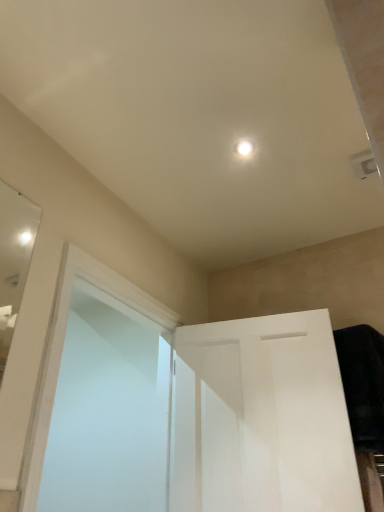
Measure the distance between frosted glass screen door at left and camera.

They are 1.77 meters apart.

The image size is (384, 512). What do you see at coordinates (109, 410) in the screenshot? I see `frosted glass screen door at left` at bounding box center [109, 410].

Locate an element on the screen. The width and height of the screenshot is (384, 512). frosted glass screen door at left is located at coordinates (109, 410).

What do you see at coordinates (261, 418) in the screenshot? This screenshot has height=512, width=384. I see `white matte door at center` at bounding box center [261, 418].

At what (x,y) coordinates should I click in order to perform the action: click on white matte door at center. Please return your answer as a coordinate pair (x, y). The width and height of the screenshot is (384, 512). Looking at the image, I should click on (261, 418).

The height and width of the screenshot is (512, 384). In order to click on frosted glass screen door at left in this screenshot , I will do `click(109, 410)`.

Based on their positions, is frosted glass screen door at left located to the left or right of white matte door at center?

frosted glass screen door at left is to the left of white matte door at center.

Relative to white matte door at center, is frosted glass screen door at left in front or behind?

In the image, frosted glass screen door at left appears in front of white matte door at center.

Which is more distant, (139, 456) or (202, 390)?

The point (139, 456) is farther.

From the image's perspective, who appears lower, frosted glass screen door at left or white matte door at center?

white matte door at center is shown below in the image.

From a real-world perspective, is frosted glass screen door at left over white matte door at center?

Yes.

Between frosted glass screen door at left and white matte door at center, which one has larger width?

Wider between the two is frosted glass screen door at left.

Can you confirm if frosted glass screen door at left is taller than white matte door at center?

Yes, frosted glass screen door at left is taller than white matte door at center.

Consider the image. Is frosted glass screen door at left bigger or smaller than white matte door at center?

frosted glass screen door at left is bigger than white matte door at center.

Is white matte door at center inside frosted glass screen door at left?

No, white matte door at center is not a part of frosted glass screen door at left.

Is there a large distance between frosted glass screen door at left and white matte door at center?

No, frosted glass screen door at left is not far away from white matte door at center.

Is frosted glass screen door at left facing towards white matte door at center?

Yes, frosted glass screen door at left is aimed at white matte door at center.

What's the angular difference between frosted glass screen door at left and white matte door at center's facing directions?

They differ by 79.1 degrees in their facing directions.

At what (x,y) coordinates should I click in order to perform the action: click on screen door in front of the white matte door at center. Please return your answer as a coordinate pair (x, y). The height and width of the screenshot is (512, 384). Looking at the image, I should click on (109, 410).

Between white matte door at center and frosted glass screen door at left, which one appears on the left side from the viewer's perspective?

frosted glass screen door at left.

Between white matte door at center and frosted glass screen door at left, which one is positioned behind?

white matte door at center is further away from the camera.

Does point (219, 455) come in front of point (131, 478)?

Yes, point (219, 455) is closer to viewer.

From the image's perspective, which object appears higher, white matte door at center or frosted glass screen door at left?

frosted glass screen door at left is shown above in the image.

From a real-world perspective, is white matte door at center below frosted glass screen door at left?

Yes.

Which object is wider, white matte door at center or frosted glass screen door at left?

frosted glass screen door at left is wider.

Considering the sizes of objects white matte door at center and frosted glass screen door at left in the image provided, who is shorter, white matte door at center or frosted glass screen door at left?

white matte door at center.

Considering the sizes of objects white matte door at center and frosted glass screen door at left in the image provided, who is smaller, white matte door at center or frosted glass screen door at left?

With smaller size is white matte door at center.

Is frosted glass screen door at left surrounded by white matte door at center?

No, white matte door at center does not contain frosted glass screen door at left.

Is white matte door at center far from frosted glass screen door at left?

white matte door at center is near frosted glass screen door at left, not far away.

Is white matte door at center turned away from frosted glass screen door at left?

→ No, frosted glass screen door at left is not at the back of white matte door at center.

How different are the orientations of white matte door at center and frosted glass screen door at left in degrees?

The angle between the facing direction of white matte door at center and the facing direction of frosted glass screen door at left is 79.1 degrees.

How much distance is there between white matte door at center and frosted glass screen door at left?

A distance of 23.99 inches exists between white matte door at center and frosted glass screen door at left.

Where is `door below the frosted glass screen door at left (from a real-world perspective)`? The height and width of the screenshot is (512, 384). door below the frosted glass screen door at left (from a real-world perspective) is located at coordinates (261, 418).

Where is `screen door that is above the white matte door at center (from a real-world perspective)`? The image size is (384, 512). screen door that is above the white matte door at center (from a real-world perspective) is located at coordinates (109, 410).

At what (x,y) coordinates should I click in order to perform the action: click on door that appears on the right of frosted glass screen door at left. Please return your answer as a coordinate pair (x, y). The height and width of the screenshot is (512, 384). Looking at the image, I should click on (261, 418).